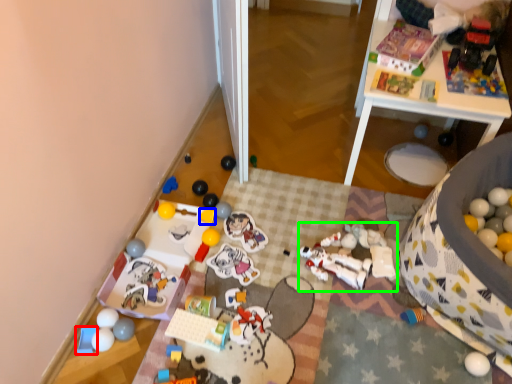
Question: Which is farther away from toy (highlighted by a red box)? toy (highlighted by a blue box) or toy (highlighted by a green box)?

Choices:
 (A) toy
 (B) toy

Answer: (B)